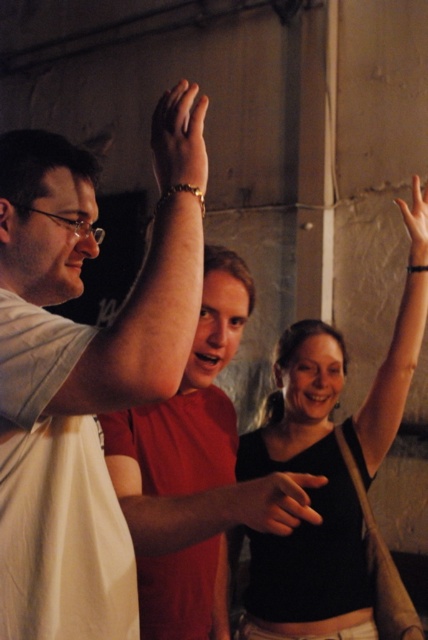
At what (x,y) coordinates should I click in order to perform the action: click on white matte shirt at upper left. Please return your answer as a coordinate pair (x, y). The width and height of the screenshot is (428, 640). Looking at the image, I should click on (83, 371).

Which is above, white matte shirt at upper left or matte gold bracelet at upper center?

Positioned higher is matte gold bracelet at upper center.

Locate an element on the screen. Image resolution: width=428 pixels, height=640 pixels. white matte shirt at upper left is located at coordinates (83, 371).

Can you confirm if matte gold bracelet at upper center is positioned to the left of matte skin hand at center?

Yes, matte gold bracelet at upper center is to the left of matte skin hand at center.

Does matte gold bracelet at upper center appear over matte skin hand at center?

Yes.

Image resolution: width=428 pixels, height=640 pixels. What do you see at coordinates (180, 140) in the screenshot?
I see `matte gold bracelet at upper center` at bounding box center [180, 140].

You are a GUI agent. You are given a task and a screenshot of the screen. Output one action in this format:
    pyautogui.click(x=<x>, y=<y>)
    Task: Click on the matte gold bracelet at upper center
    Image resolution: width=428 pixels, height=640 pixels.
    Given the screenshot: What is the action you would take?
    pyautogui.click(x=180, y=140)

Is black fabric tank top at upper right further to camera compared to matte white arm at center?

Yes, black fabric tank top at upper right is behind matte white arm at center.

Does black fabric tank top at upper right appear on the left side of matte white arm at center?

No, black fabric tank top at upper right is not to the left of matte white arm at center.

Where is `black fabric tank top at upper right`? black fabric tank top at upper right is located at coordinates (312, 502).

This screenshot has width=428, height=640. Identify the location of black fabric tank top at upper right. (312, 502).